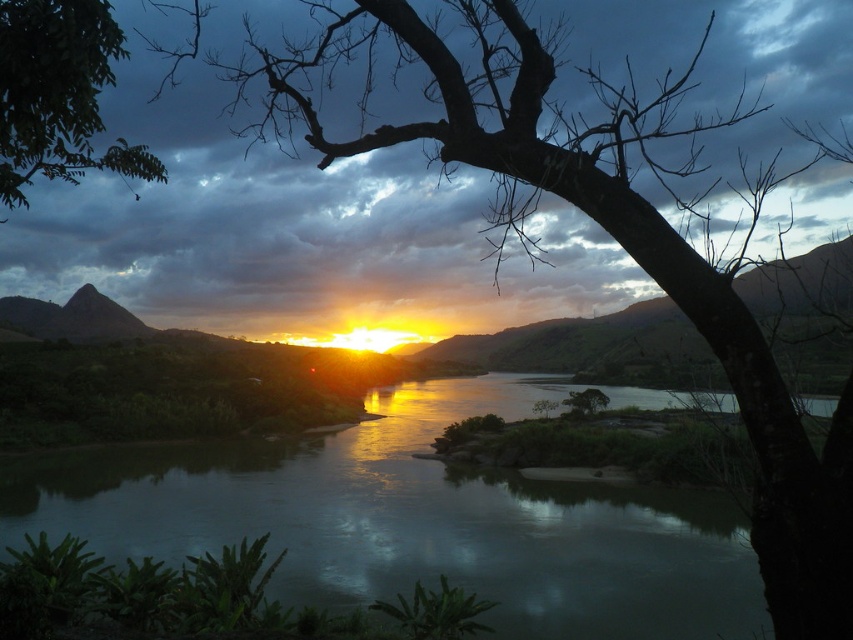
Which of these two, green reflective water at center or green leafy tree at upper left, stands shorter?

With less height is green leafy tree at upper left.

Is green reflective water at center below green leafy tree at upper left?

Yes.

Is point (364, 428) farther from camera compared to point (49, 81)?

Yes, point (364, 428) is farther from viewer.

The image size is (853, 640). In order to click on green reflective water at center in this screenshot , I will do `click(413, 522)`.